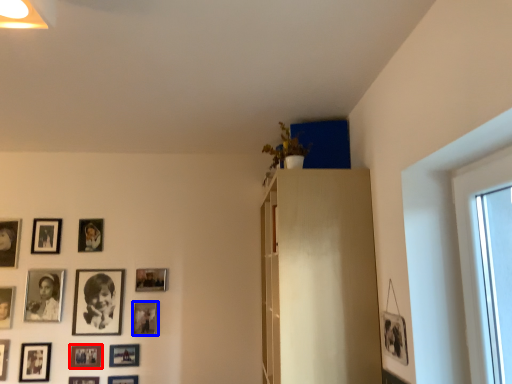
Question: Which object appears closest to the camera in this image, picture frame (highlighted by a red box) or picture frame (highlighted by a blue box)?

Choices:
 (A) picture frame
 (B) picture frame

Answer: (A)